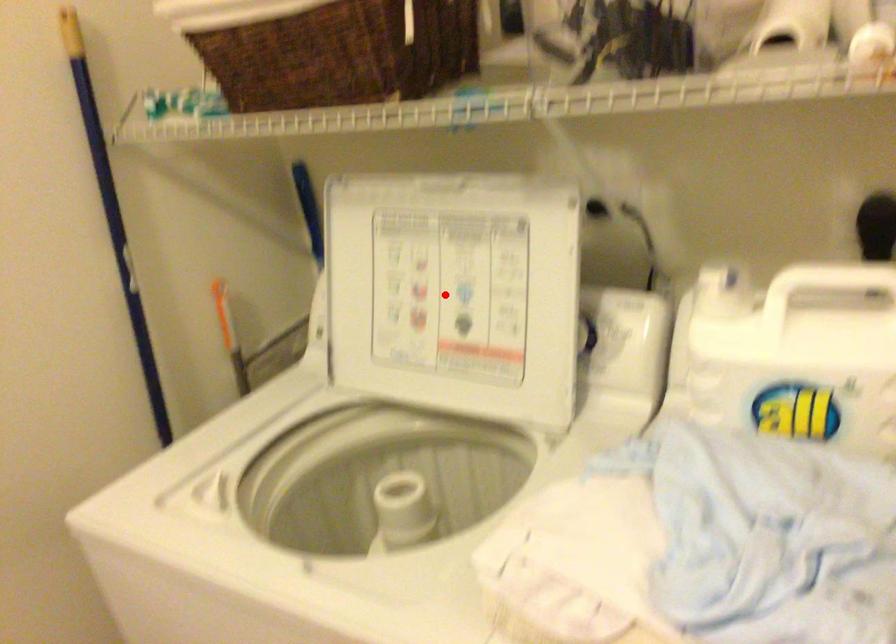
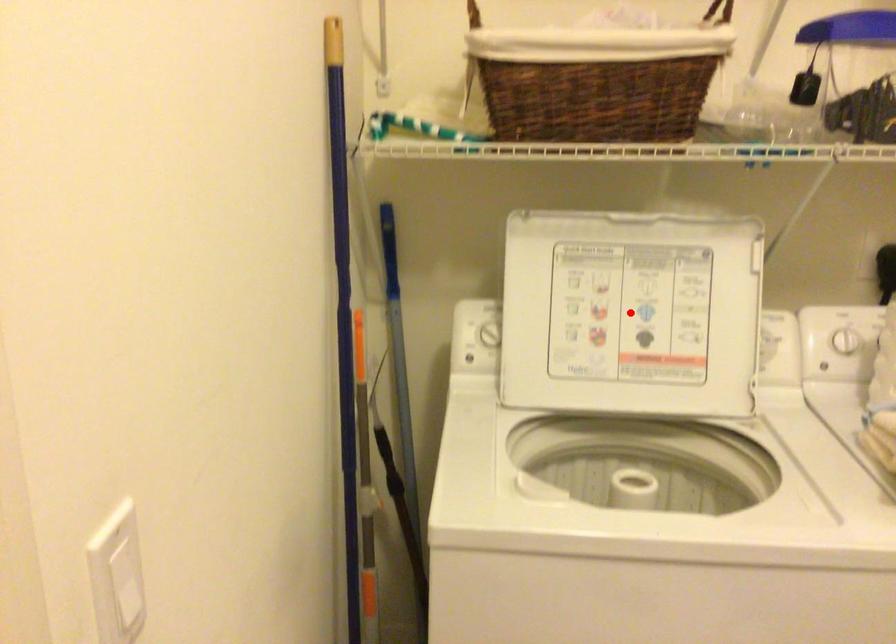
Based on the photo, I am providing you with two images of the same scene from different viewpoints. A red point is marked on the first image and another point is marked on the second image. Is the red point in image1 aligned with the point shown in image2?

Yes